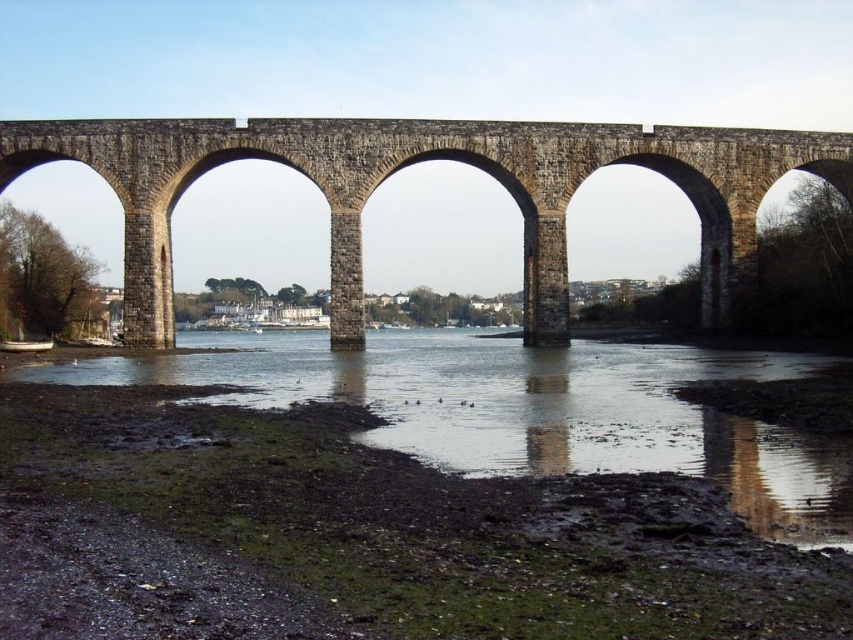
Measure the distance between muddy wet sand at lower left and camera.

235.80 feet

Does muddy wet sand at lower left have a lesser height compared to stone arch bridge at center?

Indeed, muddy wet sand at lower left has a lesser height compared to stone arch bridge at center.

What do you see at coordinates (531, 410) in the screenshot?
I see `muddy wet sand at lower left` at bounding box center [531, 410].

Find the location of a particular element. muddy wet sand at lower left is located at coordinates (531, 410).